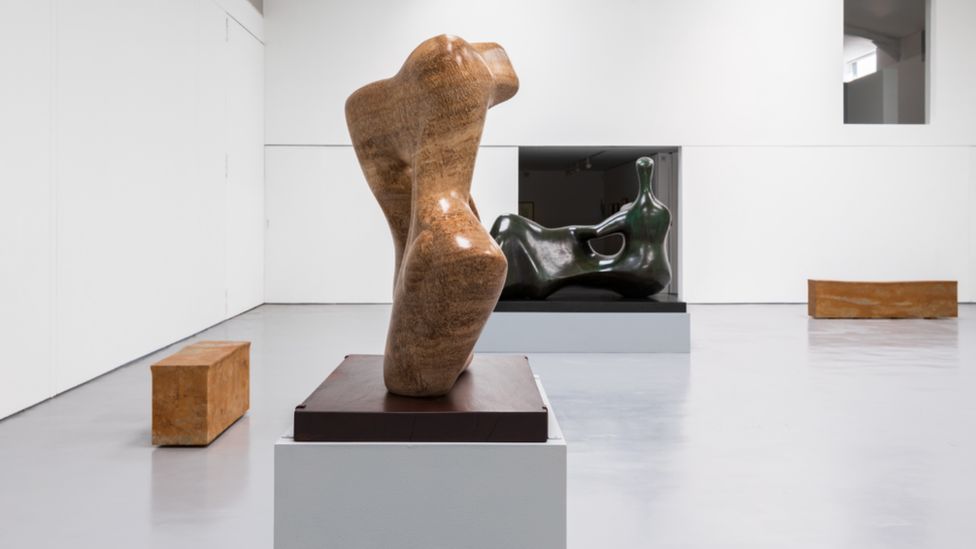
Image resolution: width=976 pixels, height=549 pixels. Find the location of `brown sculpture in the foreground`. brown sculpture in the foreground is located at coordinates (428, 156).